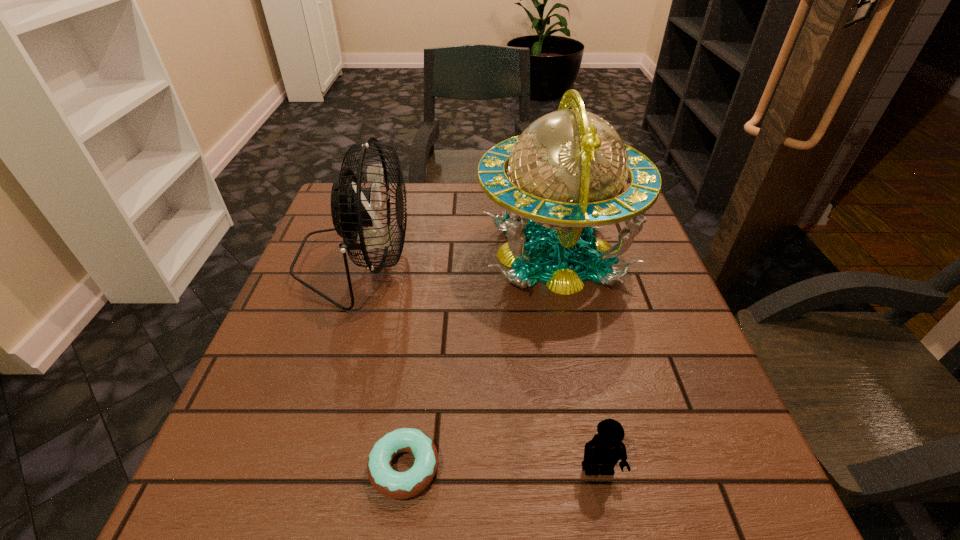
The image size is (960, 540). Find the location of `free space between the third shortest object and the doughnut`. free space between the third shortest object and the doughnut is located at coordinates (380, 365).

Identify the location of blank region between the Lego and the shortest object. This screenshot has width=960, height=540. (501, 468).

The image size is (960, 540). In order to click on vacant area between the tallest object and the second tallest object in this screenshot , I will do click(455, 258).

Identify the location of vacant space that is in between the second tallest object and the doughnut. (380, 365).

The width and height of the screenshot is (960, 540). Identify the location of vacant space in between the fan and the doughnut. (380, 365).

You are a GUI agent. You are given a task and a screenshot of the screen. Output one action in this format:
    pyautogui.click(x=<x>, y=<y>)
    Task: Click on the empty location between the shortest object and the fan
    
    Given the screenshot: What is the action you would take?
    pyautogui.click(x=380, y=365)

Where is `free spot between the Lego and the doughnut`? free spot between the Lego and the doughnut is located at coordinates pyautogui.click(x=501, y=468).

The image size is (960, 540). I want to click on vacant point located between the globe and the third shortest object, so click(455, 258).

Where is `free space between the second shortest object and the fan`? free space between the second shortest object and the fan is located at coordinates (477, 366).

At what (x,y) coordinates should I click in order to perform the action: click on free spot between the second shortest object and the third shortest object. Please return your answer as a coordinate pair (x, y). The width and height of the screenshot is (960, 540). Looking at the image, I should click on (477, 366).